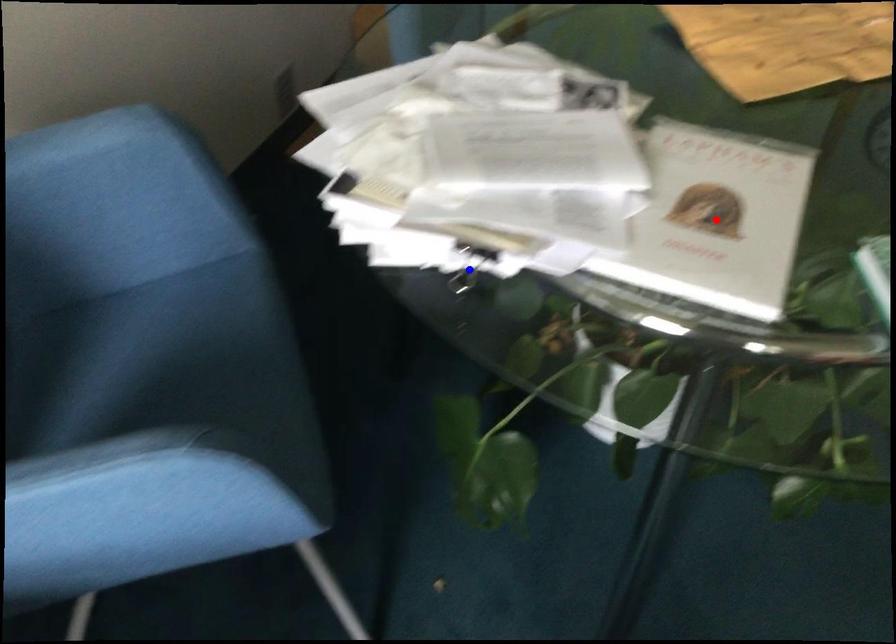
Question: Which of the two points in the image is closer to the camera?

Choices:
 (A) Blue point is closer.
 (B) Red point is closer.

Answer: (B)